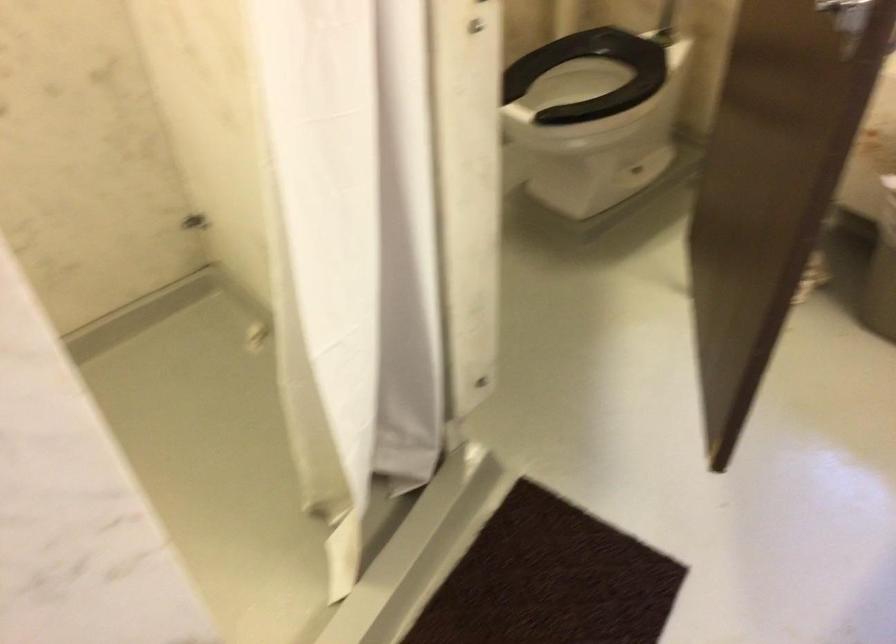
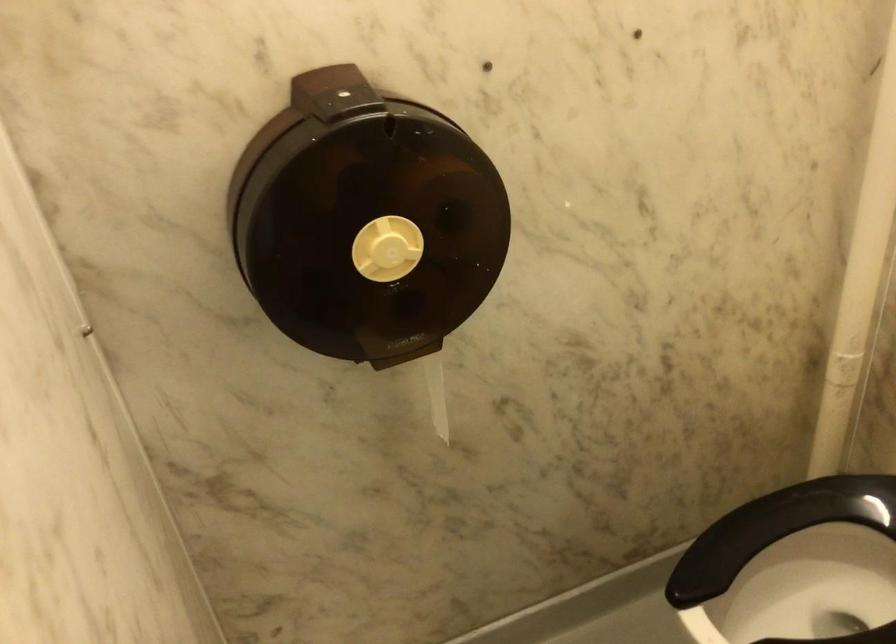
Question: What movement of the cameraman would produce the second image?

Choices:
 (A) Left
 (B) Right
 (C) Forward
 (D) Backward

Answer: (C)